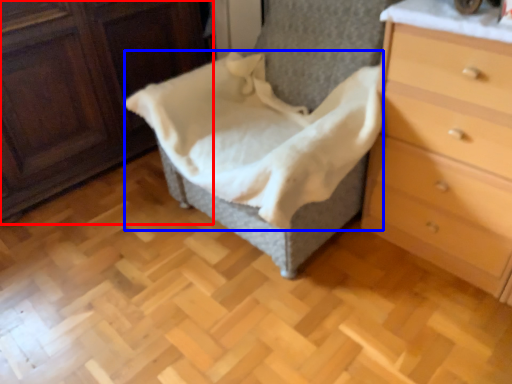
Question: Among these objects, which one is farthest to the camera, furniture (highlighted by a red box) or blanket (highlighted by a blue box)?

Choices:
 (A) furniture
 (B) blanket

Answer: (A)